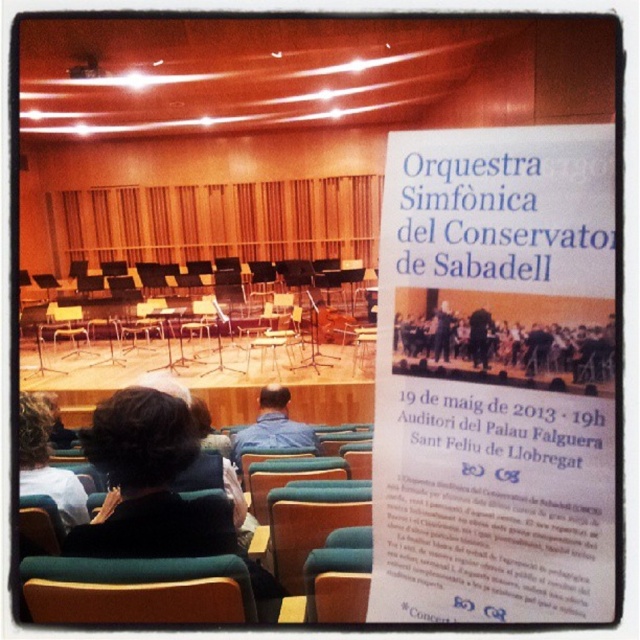
Question: Which of the following is the farthest from the observer?

Choices:
 (A) dark blue suit at center
 (B) green fabric chair at lower center
 (C) blue denim shirt at center

Answer: (C)

Question: Is dark blue suit at center below dark brown hair at lower left?

Choices:
 (A) yes
 (B) no

Answer: (B)

Question: Which point is closer to the camera?

Choices:
 (A) (513, 307)
 (B) (56, 500)
 (C) (298, 428)
 (D) (209, 570)

Answer: (A)

Question: Considering the relative positions of dark blue suit at center and dark brown hair at center in the image provided, where is dark blue suit at center located with respect to dark brown hair at center?

Choices:
 (A) below
 (B) above

Answer: (B)

Question: Which object is the farthest from the green fabric chair at lower center?

Choices:
 (A) dark blue suit at center
 (B) dark brown hair at lower left

Answer: (B)

Question: Where is dark brown hair at center located in relation to blue denim shirt at center in the image?

Choices:
 (A) right
 (B) left

Answer: (B)